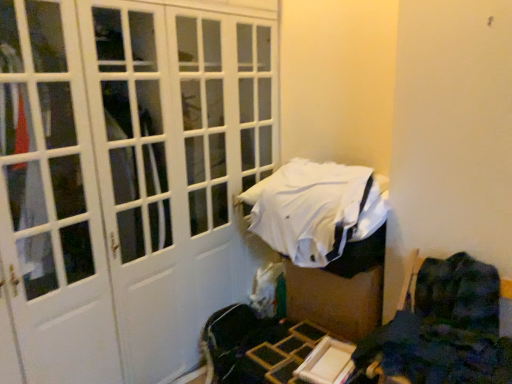
What is the approximate width of white matte door at center?

It is 22.25 inches.

Describe the element at coordinates (321, 216) in the screenshot. I see `white fabric bed at center` at that location.

The image size is (512, 384). I want to click on white matte door at center, so click(x=129, y=178).

This screenshot has width=512, height=384. I want to click on bed on the left of the dark blue fabric chair at lower right, so click(321, 216).

Considering the relative sizes of dark blue fabric chair at lower right and white fabric bed at center in the image provided, is dark blue fabric chair at lower right taller than white fabric bed at center?

Indeed, dark blue fabric chair at lower right has a greater height compared to white fabric bed at center.

Is white fabric bed at center surrounded by dark blue fabric chair at lower right?

Definitely not — white fabric bed at center is not inside dark blue fabric chair at lower right.

Consider the image. Which point is more forward, [459,377] or [167,130]?

The point [459,377] is in front.

Considering the sizes of objects dark blue fabric chair at lower right and white matte door at center in the image provided, who is wider, dark blue fabric chair at lower right or white matte door at center?

white matte door at center is wider.

Who is taller, dark blue fabric chair at lower right or white matte door at center?

With more height is white matte door at center.

Is dark blue fabric chair at lower right positioned with its back to white matte door at center?

dark blue fabric chair at lower right is not turned away from white matte door at center.

Which object is further away from the camera taking this photo, white fabric bed at center or white matte door at center?

white fabric bed at center is more distant.

Would you say white fabric bed at center is a long distance from white matte door at center?

No, white fabric bed at center is not far from white matte door at center.

Looking at the image, does white fabric bed at center seem bigger or smaller compared to white matte door at center?

Considering their sizes, white fabric bed at center takes up less space than white matte door at center.

From the picture: From a real-world perspective, is white fabric bed at center physically above white matte door at center?

No.

Is white matte door at center not near white fabric bed at center?

white matte door at center is actually quite close to white fabric bed at center.

What's the angular difference between white matte door at center and white fabric bed at center's facing directions?

87.1 degrees.

Is point (9, 0) positioned after point (361, 220)?

No, it is not.

Identify the location of door in front of the white fabric bed at center. (129, 178).

From the image's perspective, would you say white matte door at center is shown under dark blue fabric chair at lower right?

Incorrect, from the image's perspective, white matte door at center is higher than dark blue fabric chair at lower right.

Is white matte door at center not within dark blue fabric chair at lower right?

Absolutely, white matte door at center is external to dark blue fabric chair at lower right.

Is white matte door at center oriented away from dark blue fabric chair at lower right?

No, white matte door at center is not facing away from dark blue fabric chair at lower right.

Does white matte door at center touch dark blue fabric chair at lower right?

No.

Is white fabric bed at center inside the boundaries of dark blue fabric chair at lower right, or outside?

white fabric bed at center is not enclosed by dark blue fabric chair at lower right.

Who is smaller, white fabric bed at center or dark blue fabric chair at lower right?

dark blue fabric chair at lower right is smaller.

Considering the points (327, 241) and (433, 297), which point is behind, point (327, 241) or point (433, 297)?

Positioned behind is point (327, 241).

Between white fabric bed at center and dark blue fabric chair at lower right, which one appears on the left side from the viewer's perspective?

Positioned to the left is white fabric bed at center.

Find the location of a particular element. The width and height of the screenshot is (512, 384). bed above the dark blue fabric chair at lower right (from a real-world perspective) is located at coordinates (321, 216).

The width and height of the screenshot is (512, 384). I want to click on furniture that is under the white matte door at center (from a real-world perspective), so click(444, 329).

When comparing their distances from white matte door at center, does dark blue fabric chair at lower right or white fabric bed at center seem further?

Among the two, dark blue fabric chair at lower right is located further to white matte door at center.

Looking at the image, which one is located closer to dark blue fabric chair at lower right, white matte door at center or white fabric bed at center?

Based on the image, white fabric bed at center appears to be nearer to dark blue fabric chair at lower right.

Estimate the real-world distances between objects in this image. Which object is closer to white fabric bed at center, dark blue fabric chair at lower right or white matte door at center?

Based on the image, dark blue fabric chair at lower right appears to be nearer to white fabric bed at center.

From the image, which object appears to be farther from dark blue fabric chair at lower right, white fabric bed at center or white matte door at center?

white matte door at center is further to dark blue fabric chair at lower right.

Which object lies further to the anchor point white fabric bed at center, white matte door at center or dark blue fabric chair at lower right?

white matte door at center lies further to white fabric bed at center than the other object.

Based on their spatial positions, is white fabric bed at center or dark blue fabric chair at lower right further from white matte door at center?

dark blue fabric chair at lower right.

Image resolution: width=512 pixels, height=384 pixels. I want to click on bed between white matte door at center and dark blue fabric chair at lower right, so point(321,216).